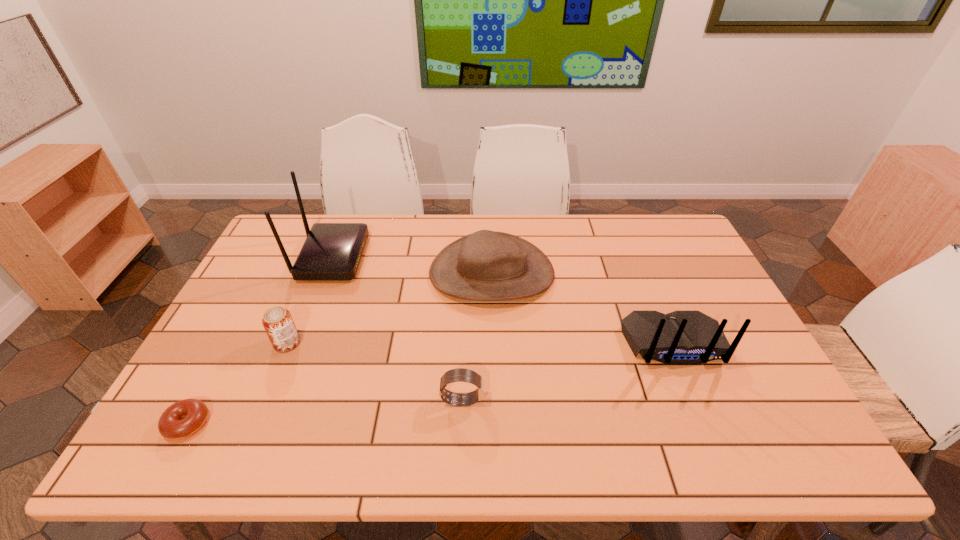
The width and height of the screenshot is (960, 540). Find the location of `the farther router`. the farther router is located at coordinates (332, 251).

The width and height of the screenshot is (960, 540). In order to click on the tallest object in this screenshot , I will do `click(332, 251)`.

The height and width of the screenshot is (540, 960). In order to click on the rightmost object in this screenshot , I will do `click(681, 337)`.

The image size is (960, 540). Identify the location of the right router. (681, 337).

Find the location of a particular element. cowboy hat is located at coordinates (486, 265).

Locate an element on the screen. beer can is located at coordinates (277, 321).

Where is `watch`? The width and height of the screenshot is (960, 540). watch is located at coordinates (459, 374).

The height and width of the screenshot is (540, 960). What are the coordinates of `the shortest object` in the screenshot? It's located at (182, 419).

You are a GUI agent. You are given a task and a screenshot of the screen. Output one action in this format:
    pyautogui.click(x=<x>, y=<y>)
    Task: Click on the leftmost object
    Image resolution: width=960 pixels, height=540 pixels.
    Given the screenshot: What is the action you would take?
    pyautogui.click(x=182, y=419)

Locate an element on the screen. The height and width of the screenshot is (540, 960). free space located on the front-facing side of the left router is located at coordinates (432, 257).